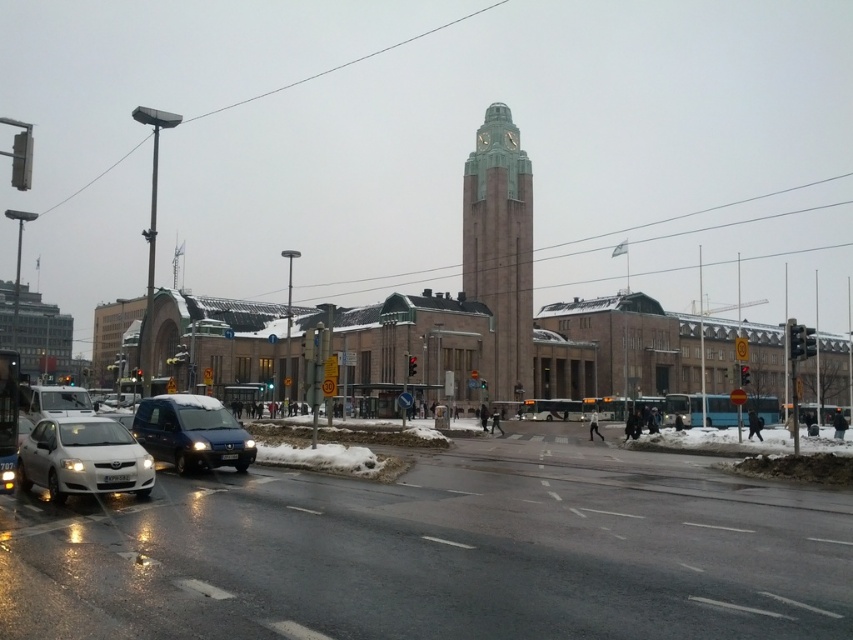
Can you confirm if green stone clock tower at center is bigger than sleek metallic van at center?

Yes, green stone clock tower at center is bigger than sleek metallic van at center.

Which is more to the right, green stone clock tower at center or sleek metallic van at center?

From the viewer's perspective, green stone clock tower at center appears more on the right side.

At what (x,y) coordinates should I click in order to perform the action: click on green stone clock tower at center. Please return your answer as a coordinate pair (x, y). The image size is (853, 640). Looking at the image, I should click on (500, 248).

Between green stone clock tower at center and white matte sedan at lower left, which one appears on the right side from the viewer's perspective?

green stone clock tower at center is more to the right.

Who is more distant from viewer, [517,259] or [109,433]?

Point [517,259]

Where is `green stone clock tower at center`? green stone clock tower at center is located at coordinates (500, 248).

The image size is (853, 640). Identify the location of white matte sedan at lower left. (83, 458).

Is point (65, 497) less distant than point (180, 454)?

Yes, it is in front of point (180, 454).

This screenshot has width=853, height=640. Identify the location of white matte sedan at lower left. (83, 458).